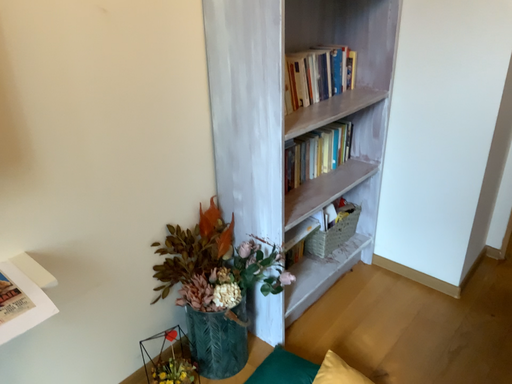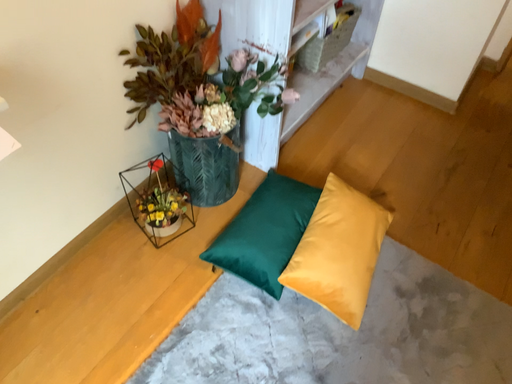
Question: How did the camera likely rotate when shooting the video?

Choices:
 (A) rotated left
 (B) rotated right

Answer: (B)